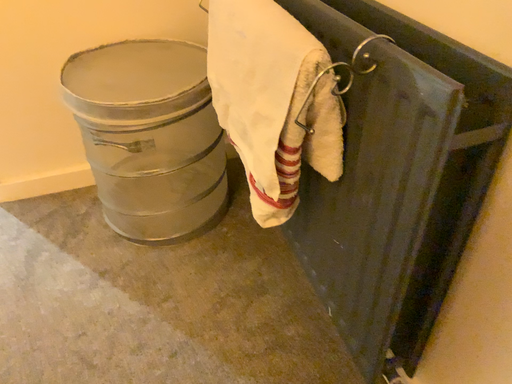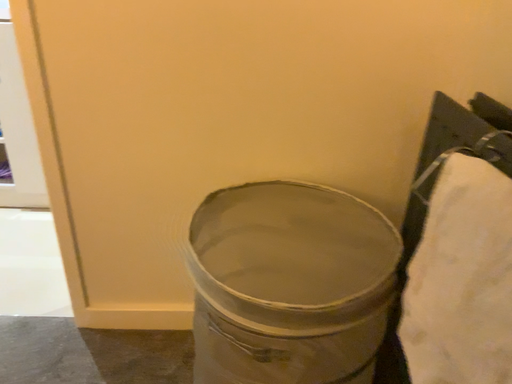
Question: Which way did the camera rotate in the video?

Choices:
 (A) rotated downward
 (B) rotated upward

Answer: (B)